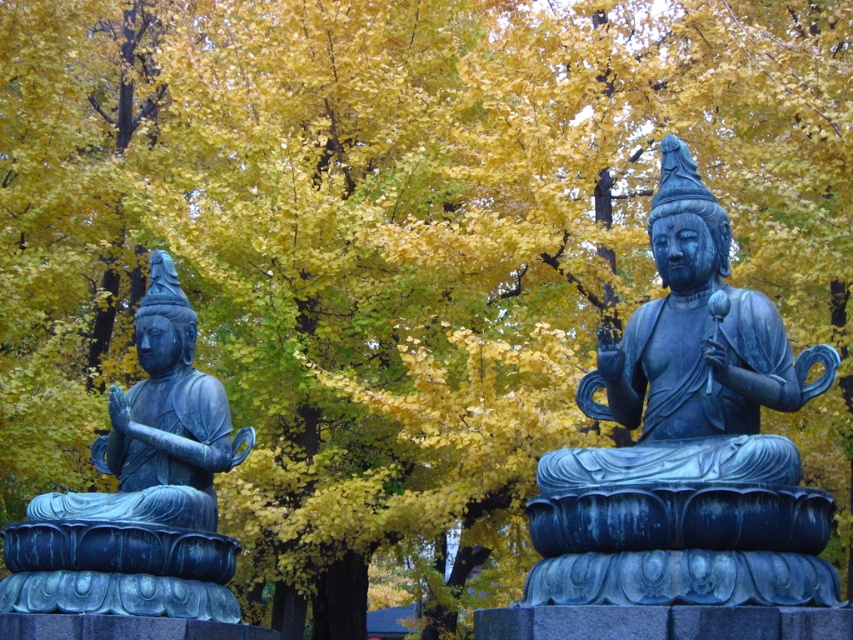
Is bronze statue at right to the left of bronze statue at left from the viewer's perspective?

In fact, bronze statue at right is to the right of bronze statue at left.

Does bronze statue at right have a lesser height compared to bronze statue at left?

Yes, bronze statue at right is shorter than bronze statue at left.

Who is more distant from viewer, (631, 518) or (151, 522)?

The point (151, 522) is behind.

Locate an element on the screen. bronze statue at right is located at coordinates (688, 442).